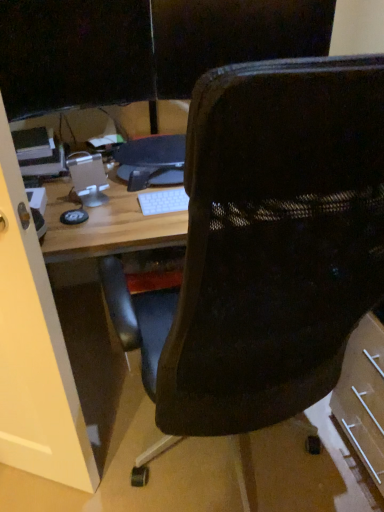
Question: Is transparent glass door at left outside black plastic monitor at center?

Choices:
 (A) no
 (B) yes

Answer: (B)

Question: Considering the relative sizes of transparent glass door at left and black plastic monitor at center in the image provided, is transparent glass door at left shorter than black plastic monitor at center?

Choices:
 (A) no
 (B) yes

Answer: (A)

Question: From a real-world perspective, is transparent glass door at left on top of black plastic monitor at center?

Choices:
 (A) yes
 (B) no

Answer: (B)

Question: Is transparent glass door at left at the left side of black plastic monitor at center?

Choices:
 (A) yes
 (B) no

Answer: (A)

Question: Does transparent glass door at left come behind black plastic monitor at center?

Choices:
 (A) no
 (B) yes

Answer: (A)

Question: From the image's perspective, is black plastic monitor at center positioned above or below black mesh chair at center?

Choices:
 (A) below
 (B) above

Answer: (B)

Question: Looking at the image, does black plastic monitor at center seem bigger or smaller compared to black mesh chair at center?

Choices:
 (A) big
 (B) small

Answer: (B)

Question: From a real-world perspective, is black plastic monitor at center above or below black mesh chair at center?

Choices:
 (A) above
 (B) below

Answer: (A)

Question: Which is correct: black plastic monitor at center is inside black mesh chair at center, or outside of it?

Choices:
 (A) outside
 (B) inside

Answer: (A)

Question: In terms of height, does black glossy monitor at upper left look taller or shorter compared to black plastic monitor at center?

Choices:
 (A) tall
 (B) short

Answer: (A)

Question: From the image's perspective, is black glossy monitor at upper left positioned above or below black plastic monitor at center?

Choices:
 (A) below
 (B) above

Answer: (B)

Question: Is black glossy monitor at upper left in front of or behind black plastic monitor at center in the image?

Choices:
 (A) behind
 (B) front

Answer: (B)

Question: Based on their sizes in the image, would you say black glossy monitor at upper left is bigger or smaller than black plastic monitor at center?

Choices:
 (A) small
 (B) big

Answer: (B)

Question: Considering the positions of point (357, 233) and point (195, 74), is point (357, 233) closer or farther from the camera than point (195, 74)?

Choices:
 (A) closer
 (B) farther

Answer: (A)

Question: From a real-world perspective, is black mesh chair at center above or below black mesh chair at upper center?

Choices:
 (A) below
 (B) above

Answer: (A)